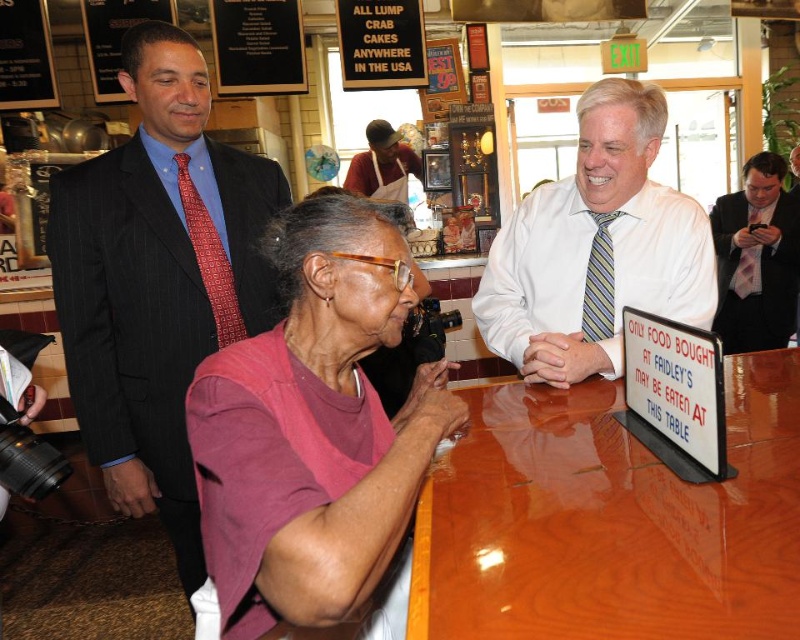
You are a delivery person who needs to place a small package between the pink fabric shirt at center and the pink fabric shirt at right. The package is 3 meters long. Will it fit between them?

The distance between the pink fabric shirt at center and the pink fabric shirt at right is 2.78 meters. Since the package is 3 meters long, it will not fit between them as it is longer than the available space.

You are a customer at the restaurant and want to find the man in the dark blue suit at center. Where would you look in relation to the white striped tie at center?

The dark blue suit at center is located below the white striped tie at center, so you should look downward from the white striped tie at center to find the dark blue suit at center.